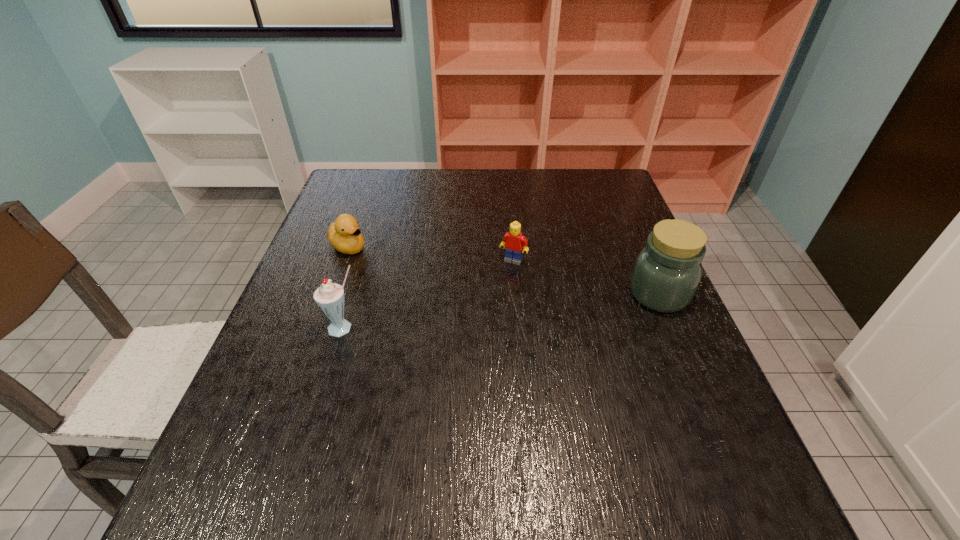
What are the coordinates of `vacant space that's between the jar and the third object from left to right` in the screenshot? It's located at (586, 277).

Identify the location of vacant space in between the milkshake and the jar. The height and width of the screenshot is (540, 960). (501, 311).

Find the location of `object that is the third closest to the duckling`. object that is the third closest to the duckling is located at coordinates (667, 271).

Identify the location of object that is the second closest one to the milkshake. (513, 242).

Locate an element on the screen. free point that satisfies the following two spatial constraints: 1. on the front side of the duckling; 2. on the left side of the rightmost object is located at coordinates (331, 294).

I want to click on blank space that satisfies the following two spatial constraints: 1. on the front side of the jar; 2. on the left side of the duckling, so click(x=331, y=294).